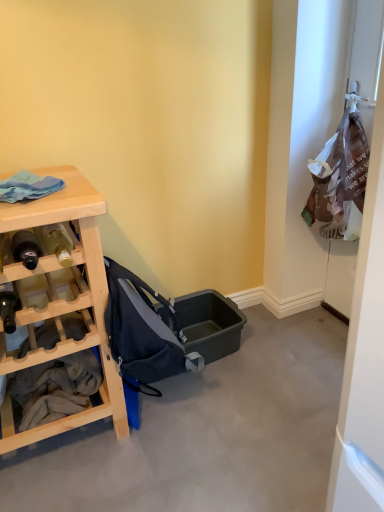
Question: Which is correct: white paper bag at right is inside dark blue fabric baby carriage at center, or outside of it?

Choices:
 (A) inside
 (B) outside

Answer: (B)

Question: Considering the positions of white paper bag at right and dark blue fabric baby carriage at center in the image, is white paper bag at right taller or shorter than dark blue fabric baby carriage at center?

Choices:
 (A) short
 (B) tall

Answer: (B)

Question: Considering the real-world distances, which object is closest to the white paper bag at right?

Choices:
 (A) matte glass bottle at left, marked as the third bottle in a bottom-to-top arrangement
 (B) matte black bottle at left, which is the second bottle in bottom-to-top order
 (C) dark blue fabric baby carriage at center
 (D) matte black bottle at left, the third bottle in the top-to-bottom sequence
 (E) white cotton towels at left

Answer: (C)

Question: Which of these objects is positioned closest to the natural wood desk at left?

Choices:
 (A) dark blue fabric baby carriage at center
 (B) matte glass bottle at left, marked as the third bottle in a bottom-to-top arrangement
 (C) matte black bottle at left, the third bottle in the top-to-bottom sequence
 (D) matte black bottle at left, which ranks as the 2th bottle in top-to-bottom order
 (E) white cotton towels at left

Answer: (A)